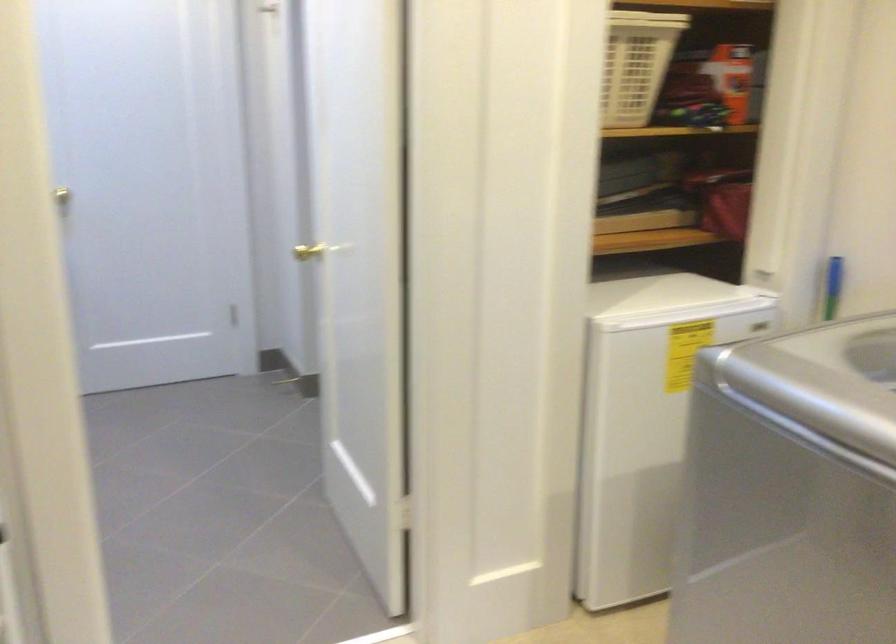
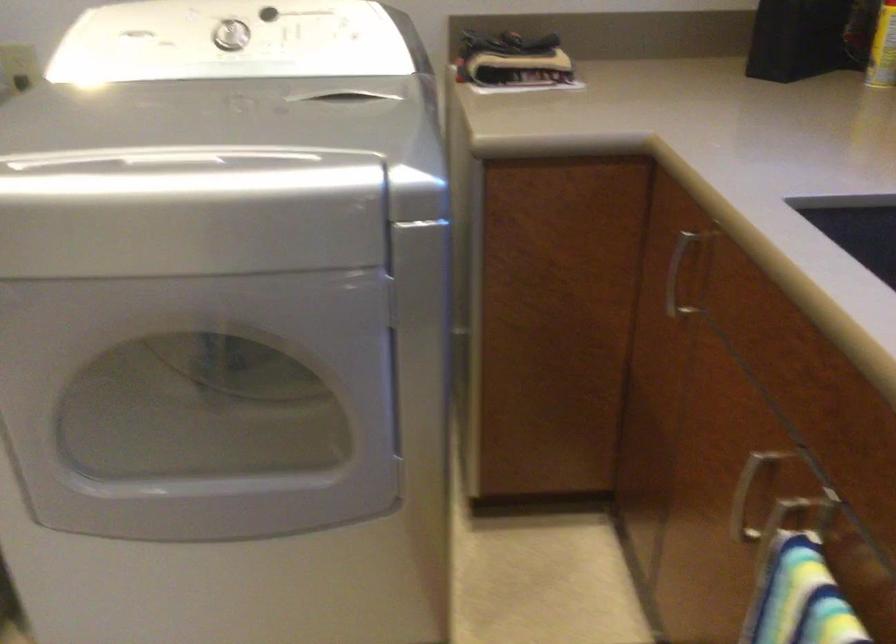
First-person continuous shooting, in which direction is the camera rotating?

The camera's rotation is toward right-down.